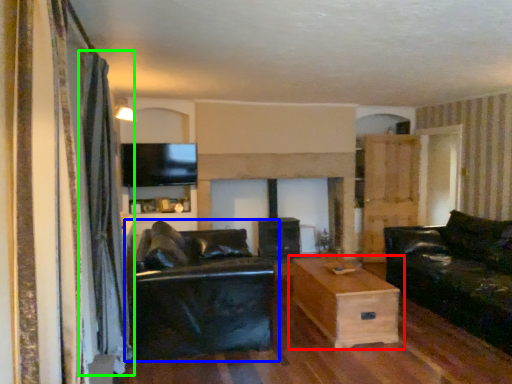
Question: Estimate the real-world distances between objects in this image. Which object is closer to table (highlighted by a red box), studio couch (highlighted by a blue box) or curtain (highlighted by a green box)?

Choices:
 (A) studio couch
 (B) curtain

Answer: (A)